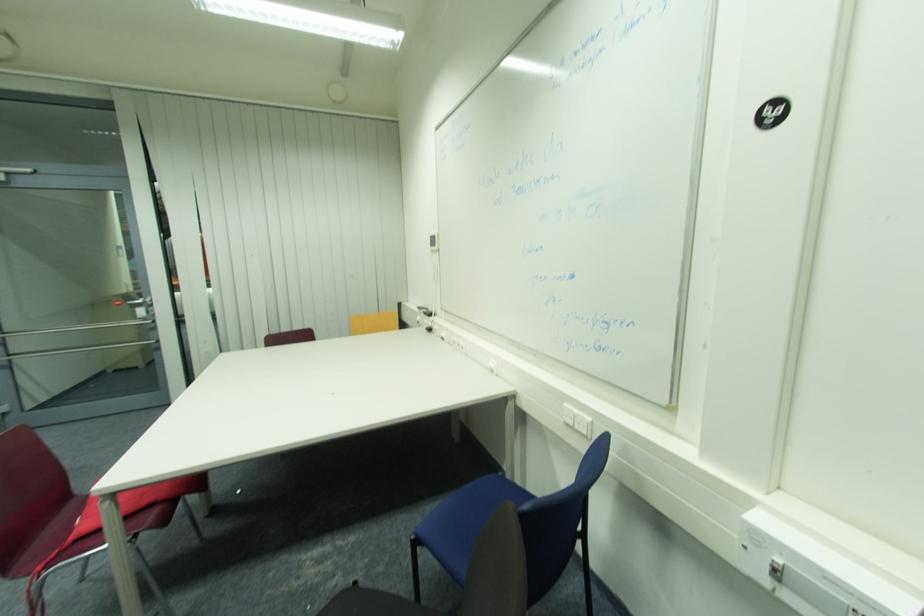
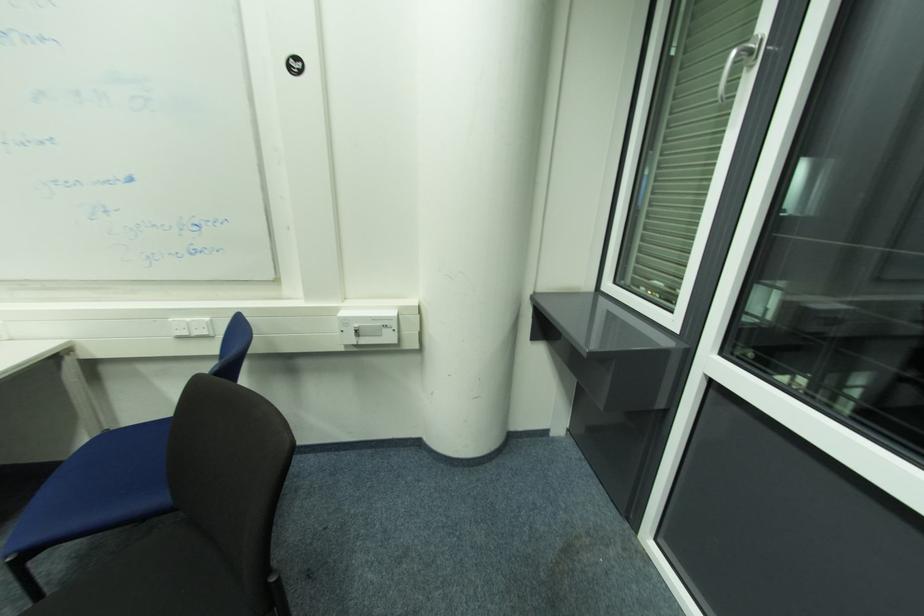
The point at (581, 413) is marked in the first image. Where is the corresponding point in the second image?

(191, 320)